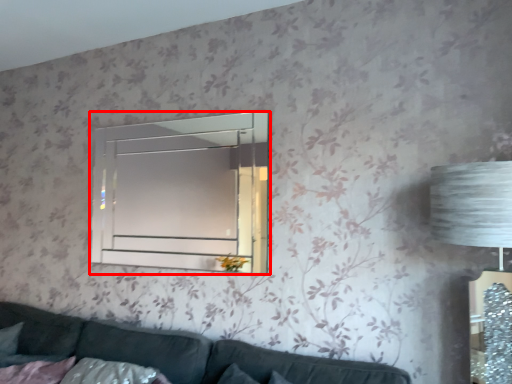
Question: Where is window (annotated by the red box) located in relation to studio couch in the image?

Choices:
 (A) right
 (B) left

Answer: (B)